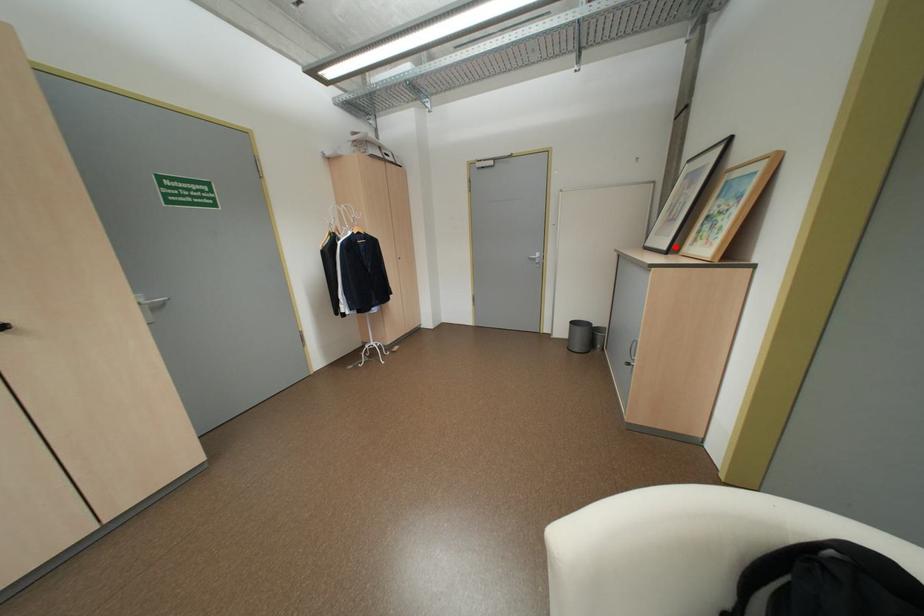
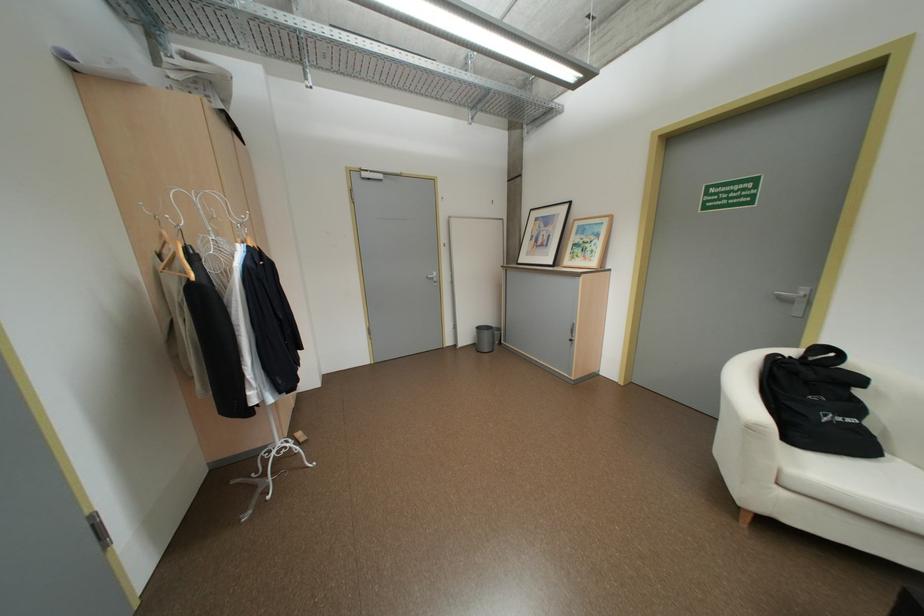
Locate, in the second image, the point that corresponds to the highlighted location in the first image.

(561, 262)